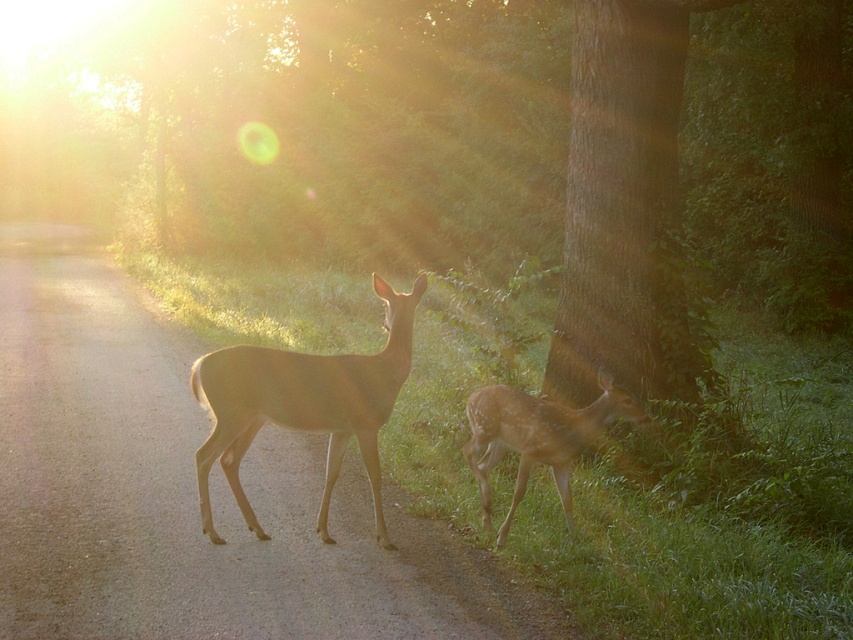
You are standing at the point marked as point (x=189, y=490). What surface are you standing on?

The point (x=189, y=490) is on the brown gravel path at center, so you are standing on the brown gravel path at center.

You are a wildlife researcher observing the golden fur deer at center and the spotted fur fawn at lower right. You need to set up a camera trap between them. Can you place it within 4 feet of both animals?

The distance between the golden fur deer at center and the spotted fur fawn at lower right is 3.73 feet. Since the camera trap needs to be placed within 4 feet of both animals, the midpoint between them would be approximately 1.865 feet from each, which is within the required distance. Yes, you can place the camera trap between them within 4 feet of both animals.

You are a hiker who wants to walk along the brown gravel path at center without getting your shoes dirty. The golden fur deer at center is standing on the path. Can you walk around the deer on the path?

The brown gravel path at center is below golden fur deer at center, meaning the deer is blocking the path. You can walk around the deer either to the left or right side of the golden fur deer at center to stay on the path without getting dirty.